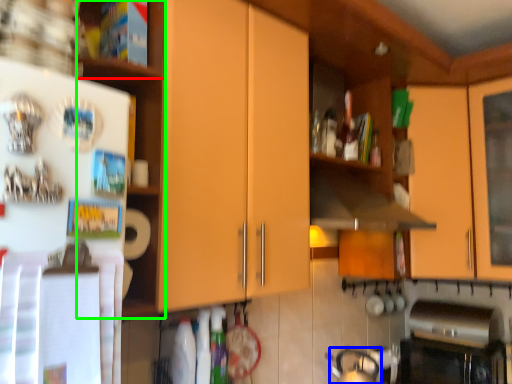
Question: Considering the real-world distances, which object is farthest from shelf (highlighted by a red box)? tea pot (highlighted by a blue box) or shelf (highlighted by a green box)?

Choices:
 (A) tea pot
 (B) shelf

Answer: (A)